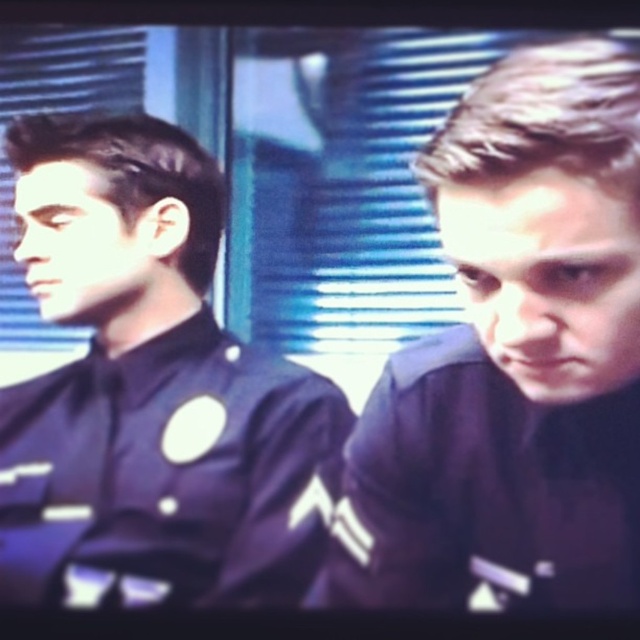
Is matte black uniform at left to the left of dark blue uniform at right from the viewer's perspective?

Correct, you'll find matte black uniform at left to the left of dark blue uniform at right.

From the picture: Can you confirm if matte black uniform at left is positioned below dark blue uniform at right?

No, matte black uniform at left is not below dark blue uniform at right.

Image resolution: width=640 pixels, height=640 pixels. Find the location of `matte black uniform at left`. matte black uniform at left is located at coordinates (148, 387).